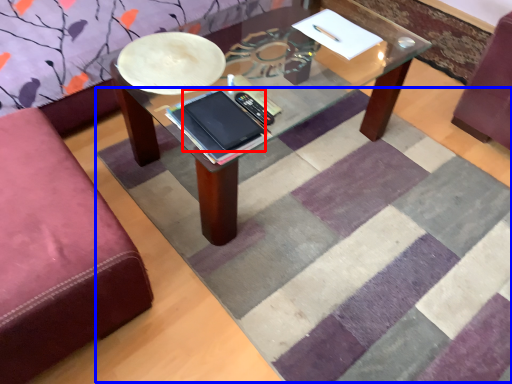
Question: Among these objects, which one is farthest to the camera, tablet computer (highlighted by a red box) or mat (highlighted by a blue box)?

Choices:
 (A) tablet computer
 (B) mat

Answer: (A)